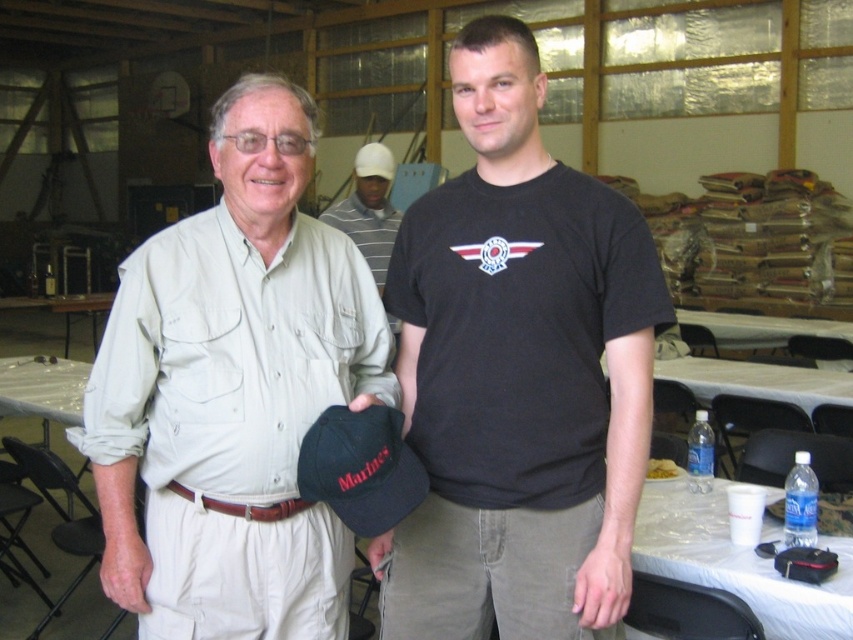
Question: Estimate the real-world distances between objects in this image. Which object is farther from the dark blue fabric baseball cap at center?

Choices:
 (A) clear plastic table at lower right
 (B) white striped shirt at upper center
 (C) light beige cotton shirt at center
 (D) brown leather belt at center

Answer: (B)

Question: Is clear plastic table at lower right closer to the viewer compared to dark blue fabric baseball cap at center?

Choices:
 (A) no
 (B) yes

Answer: (A)

Question: Is light beige cotton shirt at center below brown leather belt at center?

Choices:
 (A) yes
 (B) no

Answer: (B)

Question: Estimate the real-world distances between objects in this image. Which object is closer to the brown leather belt at center?

Choices:
 (A) dark blue fabric baseball cap at center
 (B) khaki cotton shirt at center
 (C) white plastic table at center

Answer: (A)

Question: Which object is farther from the camera taking this photo?

Choices:
 (A) brown leather belt at center
 (B) white plastic table at center
 (C) white striped shirt at upper center

Answer: (B)

Question: Can you confirm if khaki cotton shirt at center is positioned to the right of clear plastic table at lower right?

Choices:
 (A) yes
 (B) no

Answer: (B)